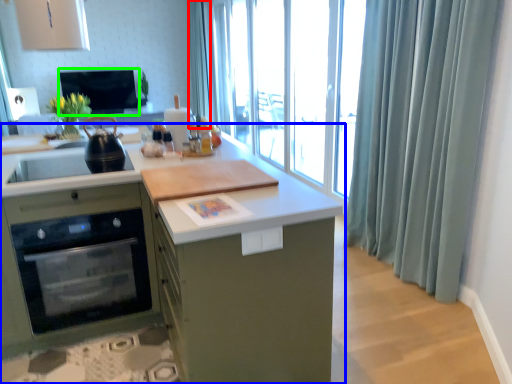
Question: Based on their relative distances, which object is nearer to shower curtain (highlighted by a red box)? Choose from cabinetry (highlighted by a blue box) and window screen (highlighted by a green box).

Choices:
 (A) cabinetry
 (B) window screen

Answer: (B)